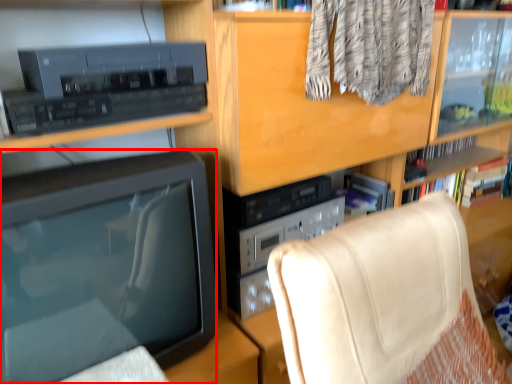
Question: From the image's perspective, where is television (annotated by the red box) located in relation to furniture in the image?

Choices:
 (A) below
 (B) above

Answer: (B)